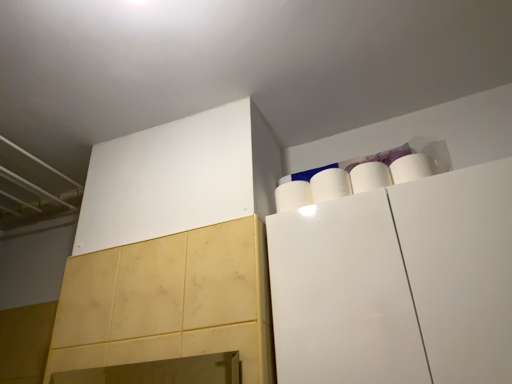
Question: From a real-world perspective, is white matte paper towel at upper right, arranged as the 2th paper towel when viewed from the right, positioned above or below white matte cabinet at upper right?

Choices:
 (A) above
 (B) below

Answer: (A)

Question: In terms of height, does white matte paper towel at upper right, which is the second paper towel from left to right, look taller or shorter compared to white matte cabinet at upper right?

Choices:
 (A) tall
 (B) short

Answer: (B)

Question: Which object is the farthest from the white matte paper towel at upper right, which ranks as the 1th paper towel in right-to-left order?

Choices:
 (A) white matte paper towel at upper right, arranged as the first paper towel when viewed from the left
 (B) white matte paper towel at upper right, which is the second paper towel from left to right
 (C) white matte cabinet at upper right

Answer: (C)

Question: Based on their relative distances, which object is farther from the white matte paper towel at upper right, the third paper towel in the left-to-right sequence?

Choices:
 (A) white matte cabinet at upper right
 (B) white matte paper towel at upper right, placed as the 3th paper towel when sorted from right to left
 (C) white matte paper towel at upper right, which is the second paper towel from left to right

Answer: (A)